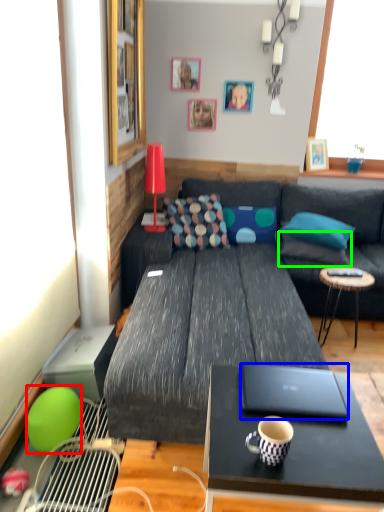
Question: Which is farther away from ball (highlighted by a red box)? laptop (highlighted by a blue box) or pillow (highlighted by a green box)?

Choices:
 (A) laptop
 (B) pillow

Answer: (B)